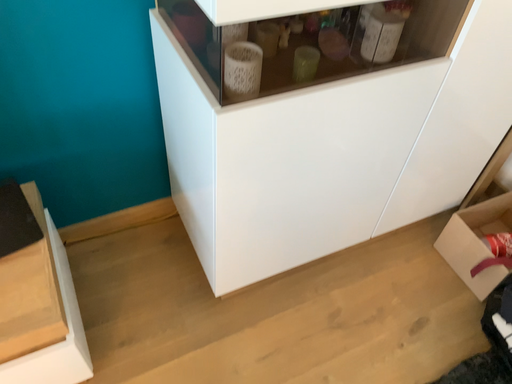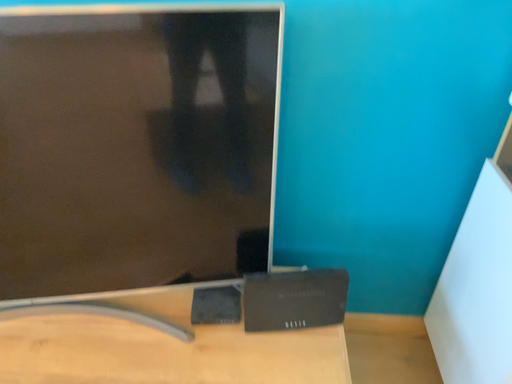
Question: Which way did the camera rotate in the video?

Choices:
 (A) rotated upward
 (B) rotated downward

Answer: (A)